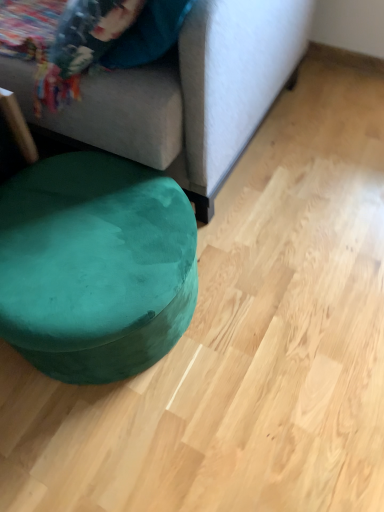
The height and width of the screenshot is (512, 384). In order to click on empty space that is to the right of velvet green bean bag at lower left in this screenshot , I will do `click(280, 290)`.